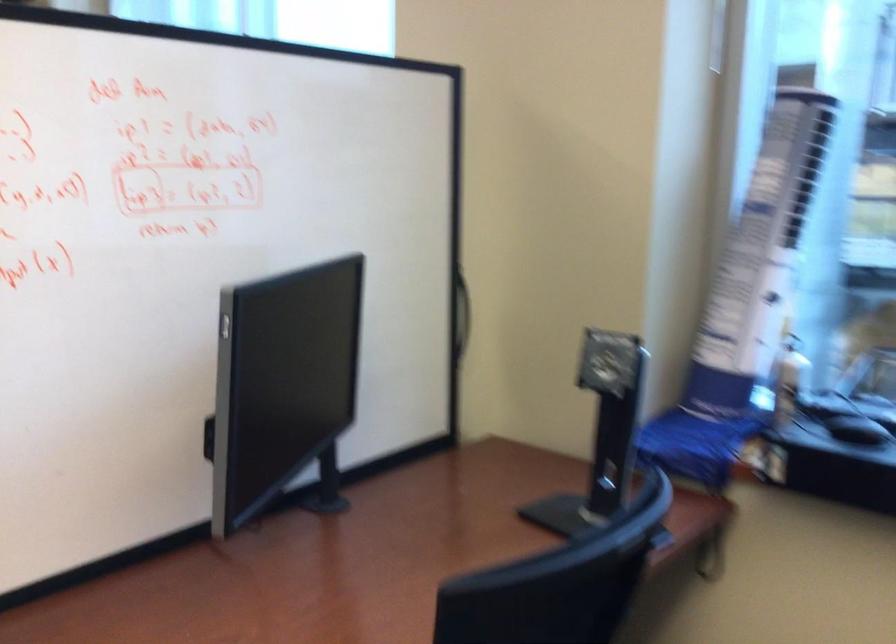
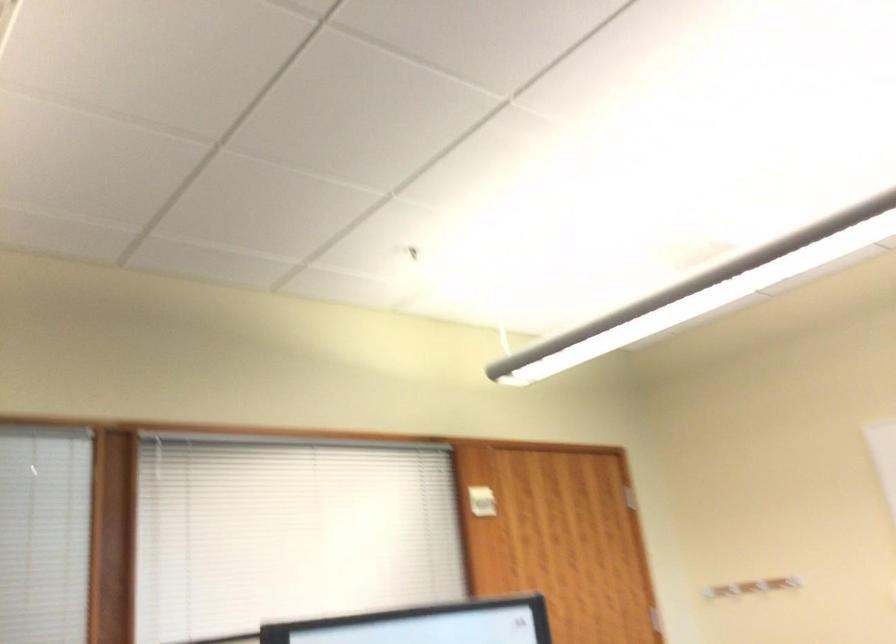
The first image is from the beginning of the video and the second image is from the end. How did the camera likely rotate when shooting the video?

The camera rotated toward left-up.